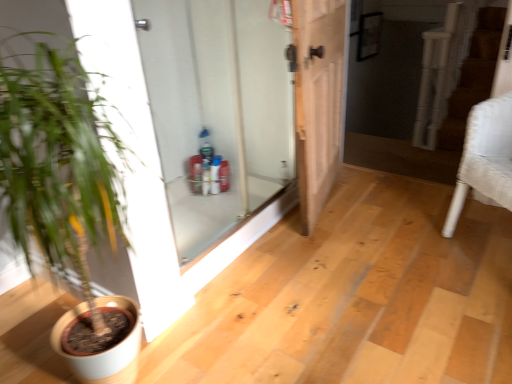
The width and height of the screenshot is (512, 384). What are the coordinates of `free space that is in between white matte pot at left and white textured armchair at right` in the screenshot? It's located at (362, 299).